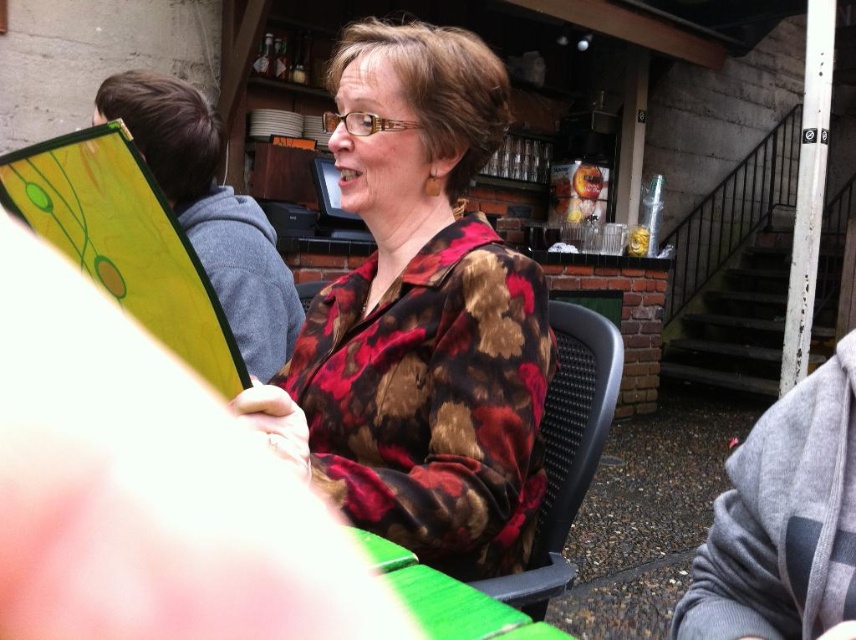
Question: Is floral-patterned shirt at center smaller than black mesh chair at center?

Choices:
 (A) no
 (B) yes

Answer: (A)

Question: Among these points, which one is nearest to the camera?

Choices:
 (A) (402, 509)
 (B) (617, 360)

Answer: (A)

Question: Is the position of floral-patterned shirt at center more distant than that of black mesh chair at center?

Choices:
 (A) no
 (B) yes

Answer: (A)

Question: Which object appears farthest from the camera in this image?

Choices:
 (A) black mesh chair at center
 (B) floral-patterned shirt at center

Answer: (A)

Question: Which point appears closest to the camera in this image?

Choices:
 (A) (397, 404)
 (B) (550, 492)

Answer: (A)

Question: Does floral-patterned shirt at center lie behind black mesh chair at center?

Choices:
 (A) no
 (B) yes

Answer: (A)